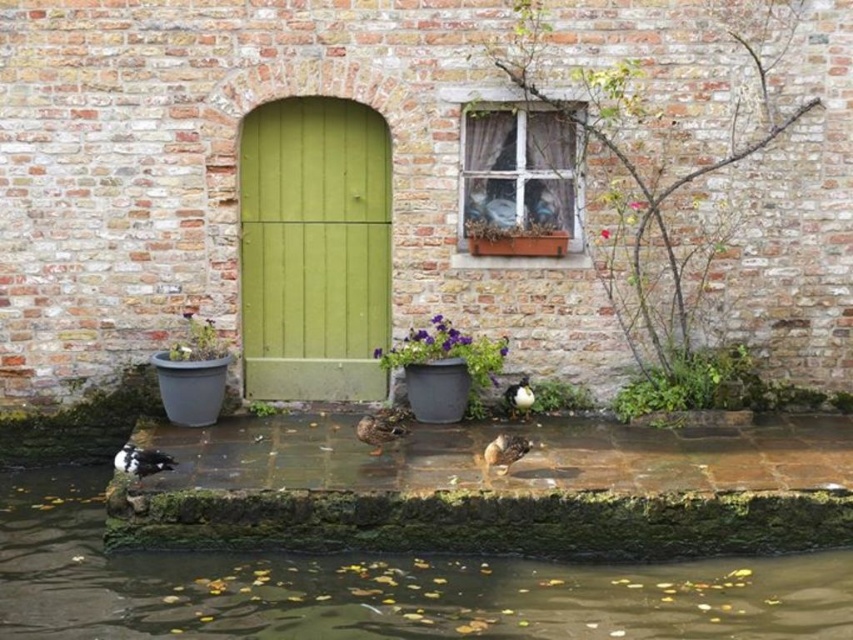
Question: Which point is closer to the camera taking this photo?

Choices:
 (A) (837, 608)
 (B) (189, 358)
 (C) (634, 403)
 (D) (692, 164)

Answer: (A)

Question: Which object is farther from the camera taking this photo?

Choices:
 (A) purple flowerpot at center
 (B) green wooden door at center
 (C) brown mossy water at lower center
 (D) brown feathered duck at center

Answer: (B)

Question: Can you confirm if green wooden door at center is positioned above green leafy plant at center?

Choices:
 (A) yes
 (B) no

Answer: (A)

Question: Among these objects, which one is nearest to the camera?

Choices:
 (A) green leafy plant at center
 (B) brown feathered duck at center
 (C) brown mossy water at lower center
 (D) white speckled duck at lower left

Answer: (C)

Question: Does brown mossy water at lower center appear on the right side of brown matte duck at center?

Choices:
 (A) no
 (B) yes

Answer: (B)

Question: Is green wooden door at center bigger than brown feathered duck at center?

Choices:
 (A) yes
 (B) no

Answer: (A)